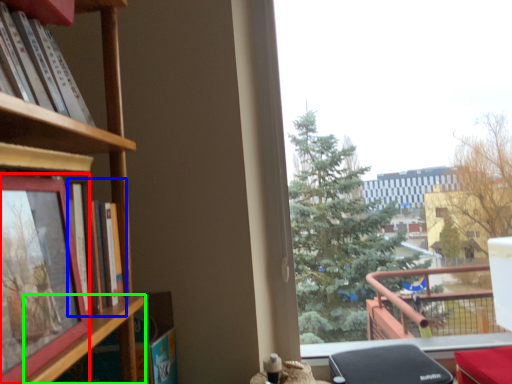
Question: Estimate the real-world distances between objects in this image. Which object is closer to picture frame (highlighted by a red box), book (highlighted by a blue box) or shelf (highlighted by a green box)?

Choices:
 (A) book
 (B) shelf

Answer: (B)